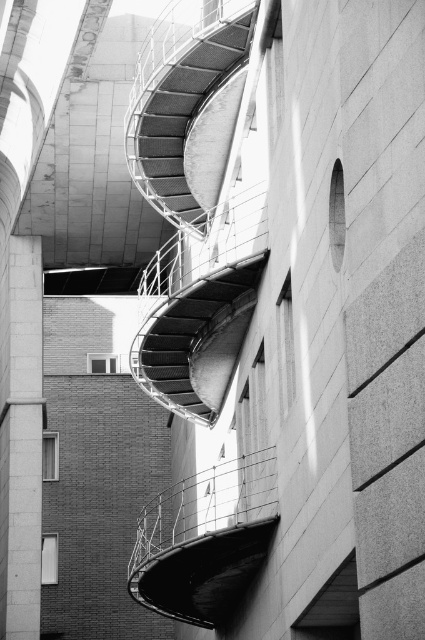
You are standing in front of the modern building with the curved staircase. You notice two points marked on the image at coordinates point (147,576) and point (141,173). Which of these points is closer to you?

Point (147,576) is closer to the camera than point (141,173).

You are an architect analyzing the building layout. You notice the metallic wire balustrade at center and the metallic mesh staircase at upper center. Which object is positioned higher in the image?

The metallic mesh staircase at upper center is positioned higher in the image than the metallic wire balustrade at center.

You are an architect reviewing this building design. You notice the metallic wire balustrade at center and the metallic mesh staircase at center. Which one appears closer to you in the image?

The metallic wire balustrade at center is in front of the metallic mesh staircase at center, so it appears closer to you.